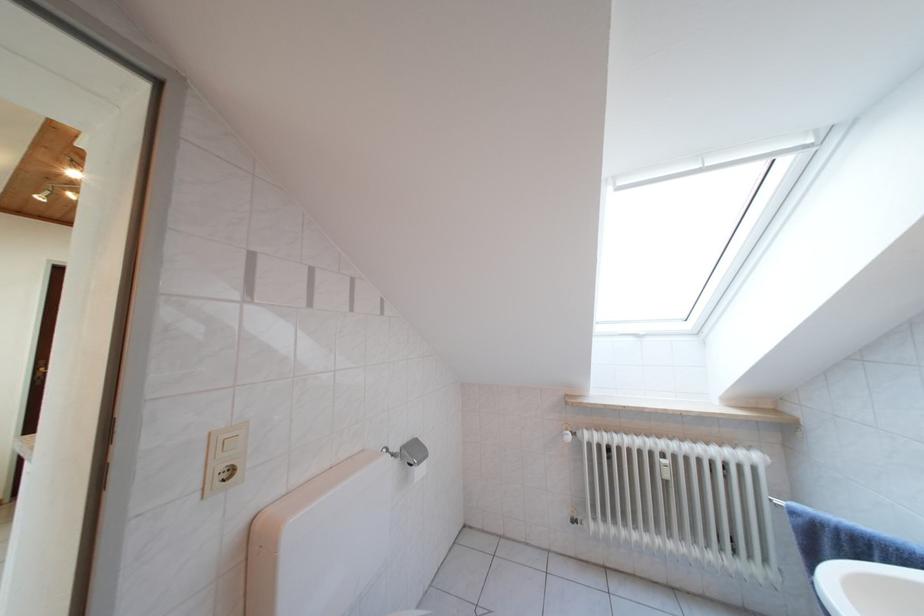
Locate an element on the screen. white toilet lid is located at coordinates (869, 589).